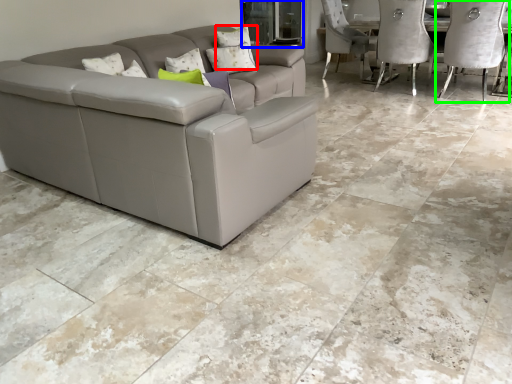
Question: Based on their relative distances, which object is nearer to pillow (highlighted by a red box)? Choose from glass door (highlighted by a blue box) and chair (highlighted by a green box).

Choices:
 (A) glass door
 (B) chair

Answer: (A)